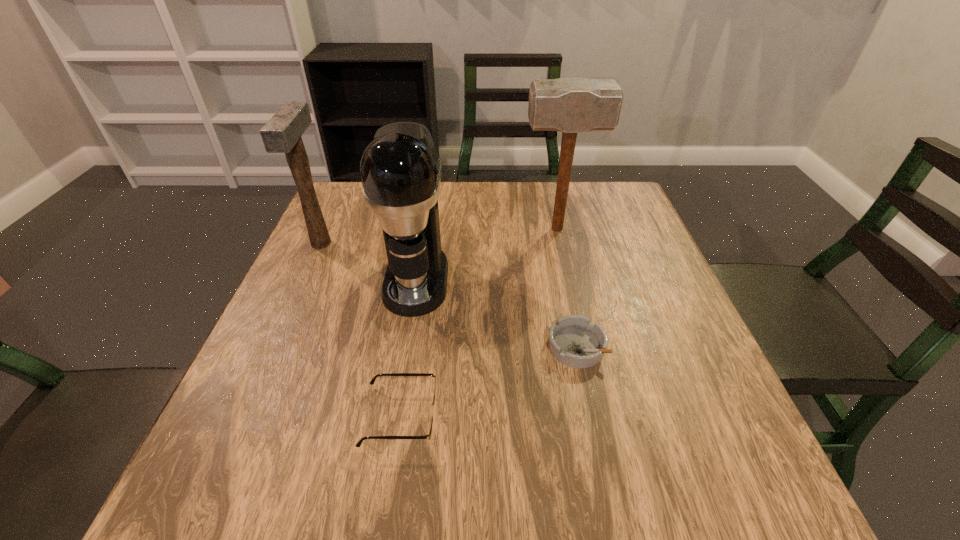
Where is `free space located at the hinge ends of the nearest object`? The height and width of the screenshot is (540, 960). free space located at the hinge ends of the nearest object is located at coordinates (508, 416).

I want to click on vacant point located on the left of the fourth farthest object, so click(x=396, y=347).

The image size is (960, 540). I want to click on object at the left edge, so click(x=282, y=133).

Where is `object situated at the right edge`? The height and width of the screenshot is (540, 960). object situated at the right edge is located at coordinates pyautogui.click(x=569, y=105).

Image resolution: width=960 pixels, height=540 pixels. Find the location of `object that is at the far left corner`. object that is at the far left corner is located at coordinates (282, 133).

This screenshot has height=540, width=960. Identify the location of object that is at the far right corner. (569, 105).

Locate an element on the screen. free space at the far edge is located at coordinates (510, 225).

At what (x,y) coordinates should I click in order to perform the action: click on free space at the near edge of the desktop. Please return your answer as a coordinate pair (x, y). This screenshot has height=540, width=960. Looking at the image, I should click on (352, 496).

I want to click on vacant space at the left edge of the desktop, so click(x=251, y=380).

Find the location of a particular element. blank space at the right edge of the desktop is located at coordinates [x=659, y=306].